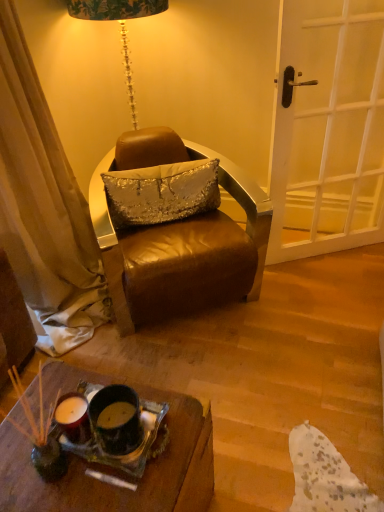
Question: Considering the relative sizes of silver sequined pillow at center and leather chair at center in the image provided, is silver sequined pillow at center wider than leather chair at center?

Choices:
 (A) yes
 (B) no

Answer: (B)

Question: Is silver sequined pillow at center bigger than leather chair at center?

Choices:
 (A) no
 (B) yes

Answer: (A)

Question: Is silver sequined pillow at center completely or partially outside of leather chair at center?

Choices:
 (A) yes
 (B) no

Answer: (B)

Question: From the image's perspective, would you say silver sequined pillow at center is positioned over leather chair at center?

Choices:
 (A) yes
 (B) no

Answer: (A)

Question: From the image's perspective, is silver sequined pillow at center below leather chair at center?

Choices:
 (A) yes
 (B) no

Answer: (B)

Question: Looking at their shapes, would you say leather chair at center is wider or thinner than silver sequined pillow at center?

Choices:
 (A) wide
 (B) thin

Answer: (A)

Question: Is leather chair at center situated inside silver sequined pillow at center or outside?

Choices:
 (A) outside
 (B) inside

Answer: (A)

Question: From a real-world perspective, relative to silver sequined pillow at center, is leather chair at center vertically above or below?

Choices:
 (A) below
 (B) above

Answer: (A)

Question: Does point (183, 296) appear closer or farther from the camera than point (110, 200)?

Choices:
 (A) closer
 (B) farther

Answer: (A)

Question: From a real-world perspective, relative to white wooden door at right, is translucent glass tray at lower center vertically above or below?

Choices:
 (A) below
 (B) above

Answer: (A)

Question: Based on their sizes in the image, would you say translucent glass tray at lower center is bigger or smaller than white wooden door at right?

Choices:
 (A) small
 (B) big

Answer: (A)

Question: From their relative heights in the image, would you say translucent glass tray at lower center is taller or shorter than white wooden door at right?

Choices:
 (A) short
 (B) tall

Answer: (A)

Question: From the image's perspective, is translucent glass tray at lower center above or below white wooden door at right?

Choices:
 (A) below
 (B) above

Answer: (A)

Question: From the image's perspective, relative to silver sequined pillow at center, is translucent glass tray at lower center above or below?

Choices:
 (A) below
 (B) above

Answer: (A)

Question: Relative to silver sequined pillow at center, is translucent glass tray at lower center in front or behind?

Choices:
 (A) front
 (B) behind

Answer: (A)